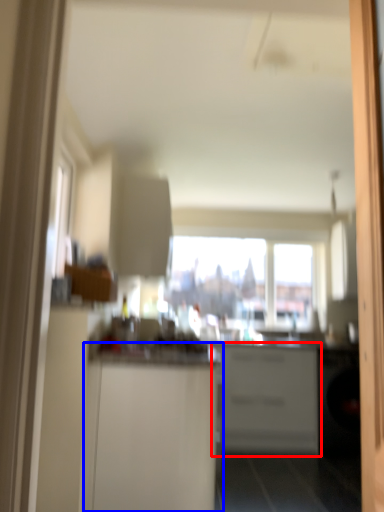
Question: Among these objects, which one is farthest to the camera, cabinetry (highlighted by a red box) or cabinetry (highlighted by a blue box)?

Choices:
 (A) cabinetry
 (B) cabinetry

Answer: (A)